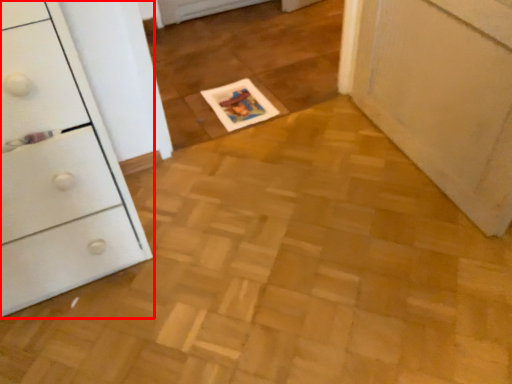
Question: From the image's perspective, where is chest of drawers (annotated by the red box) located in relation to magazine in the image?

Choices:
 (A) above
 (B) below

Answer: (B)